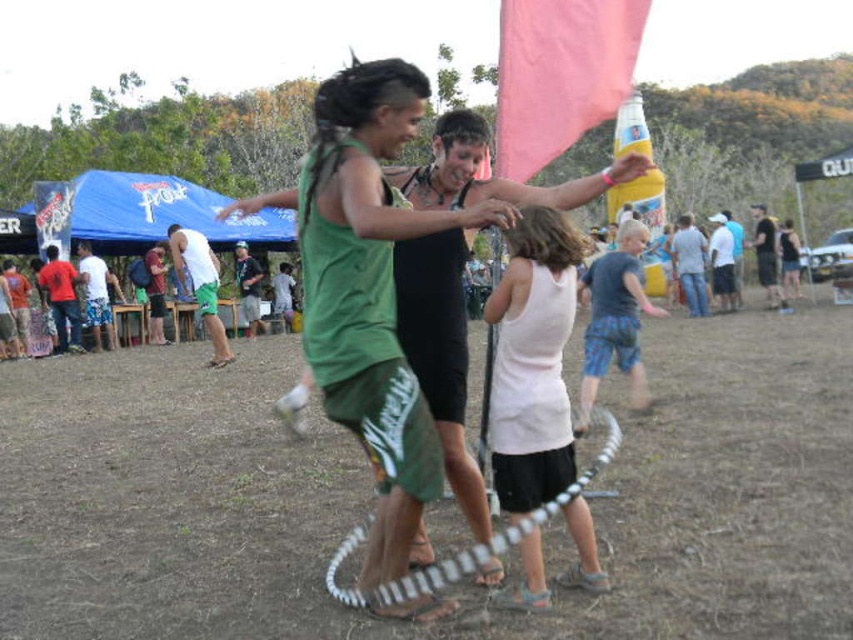
Which is above, brown dirt field at center or black matte shorts at center?

Positioned higher is black matte shorts at center.

Measure the distance between brown dirt field at center and camera.

brown dirt field at center and camera are 3.32 meters apart from each other.

You are a GUI agent. You are given a task and a screenshot of the screen. Output one action in this format:
    pyautogui.click(x=<x>, y=<y>)
    Task: Click on the brown dirt field at center
    
    Given the screenshot: What is the action you would take?
    pyautogui.click(x=368, y=493)

Between black matte shorts at center and matte red shirt at left, which one is positioned higher?

Positioned higher is matte red shirt at left.

Is black matte shorts at center shorter than matte red shirt at left?

Yes.

Is point (463, 388) farther from viewer compared to point (50, 248)?

No, it is not.

I want to click on black matte shorts at center, so click(x=440, y=353).

Which of these two, white matte shorts at center or white cotton shirt at right, stands shorter?

With less height is white cotton shirt at right.

The height and width of the screenshot is (640, 853). I want to click on white matte shorts at center, so click(x=200, y=284).